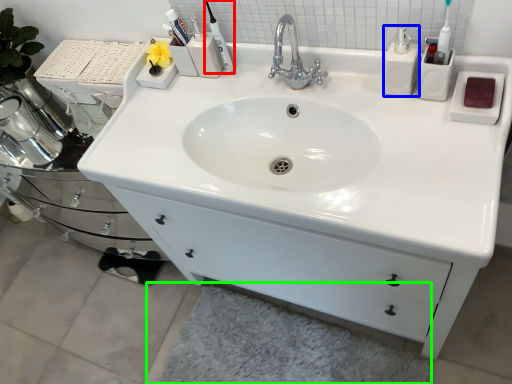
Question: Which object is the farthest from toiletry (highlighted by a red box)? Choose among these: soap dispenser (highlighted by a blue box) or bath mat (highlighted by a green box).

Choices:
 (A) soap dispenser
 (B) bath mat

Answer: (B)